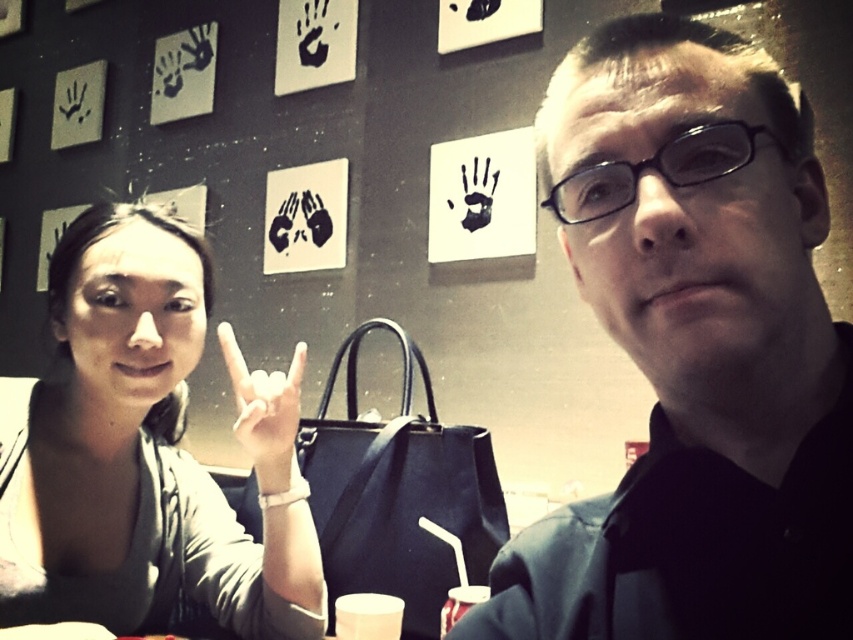
Question: Can you confirm if matte gray shirt at left is positioned above white matte hand at center?

Choices:
 (A) no
 (B) yes

Answer: (A)

Question: Is black matte shirt at center smaller than matte gray shirt at left?

Choices:
 (A) no
 (B) yes

Answer: (B)

Question: Which of these objects is positioned closest to the translucent plastic cup at lower center?

Choices:
 (A) white matte hand at center
 (B) matte gray shirt at left

Answer: (A)

Question: Can you confirm if matte gray shirt at left is positioned below white matte cup at lower center?

Choices:
 (A) yes
 (B) no

Answer: (B)

Question: Estimate the real-world distances between objects in this image. Which object is farther from the white matte hand at center?

Choices:
 (A) matte gray shirt at left
 (B) white matte cup at lower center
 (C) black matte shirt at center
 (D) translucent plastic cup at lower center

Answer: (C)

Question: Which point is closer to the camera?

Choices:
 (A) white matte hand at center
 (B) matte gray shirt at left

Answer: (B)